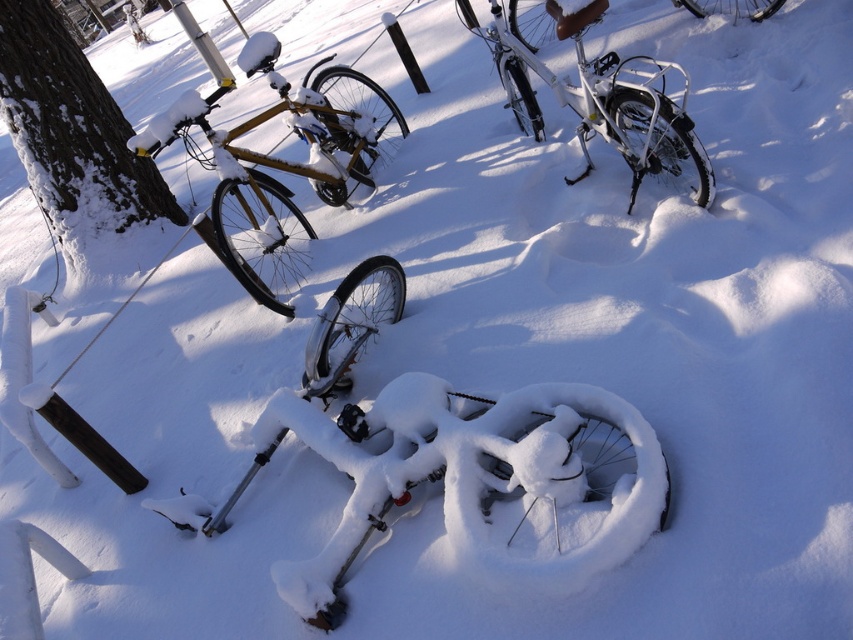
You are standing in the snowy scene and want to take a photo of the dark brown bark tree at left. If your camera has a maximum focus range of 15 feet, will you need to move closer to the tree to take a clear photo?

The dark brown bark tree at left and viewer are 16.22 feet apart from each other, so you need to move closer to the tree to be within the camera focus range of 15 feet.

From the picture: You are a delivery person trying to navigate through the snowy area. You see the dark brown bark tree at left and the white matte bicycle at upper center. Which object is positioned higher up in the image?

The white matte bicycle at upper center is positioned higher up in the image than the dark brown bark tree at left.

You are a delivery person trying to decide which bicycle to use for a quick delivery. You need to choose between the white matte bicycle at upper center and the shiny silver bicycle at upper right. Based on their visibility in the snow, which one do you think is easier to see from a distance?

The white matte bicycle at upper center is taller than the shiny silver bicycle at upper right, so it would be more visible from a distance.